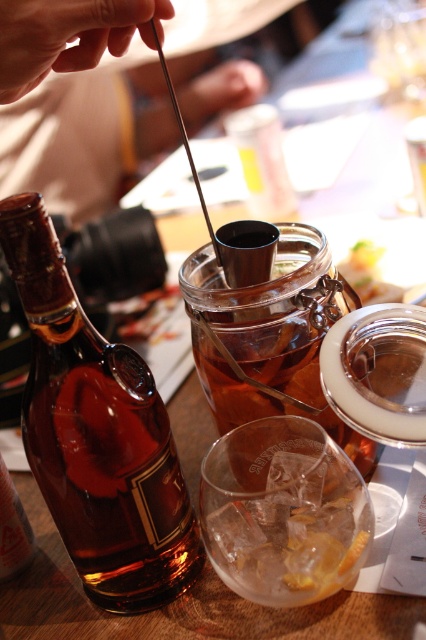
Which is below, metallic silver spoon at upper center or translucent glass jar at center?

translucent glass jar at center is below.

Between point (109, 33) and point (230, 390), which one is positioned behind?

The point (230, 390) is more distant.

Locate an element on the screen. This screenshot has height=640, width=426. metallic silver spoon at upper center is located at coordinates (66, 96).

Can you confirm if brown glass bottle at left is taller than translucent glass jar at center?

Correct, brown glass bottle at left is much taller as translucent glass jar at center.

I want to click on brown glass bottle at left, so click(x=97, y=433).

Identify the location of brown glass bottle at left. The image size is (426, 640). (97, 433).

Can you confirm if clear glass at center is bigger than translucent glass jar at center?

Actually, clear glass at center might be smaller than translucent glass jar at center.

Does clear glass at center appear on the right side of translucent glass jar at center?

Incorrect, clear glass at center is not on the right side of translucent glass jar at center.

Is point (307, 497) closer to viewer compared to point (247, 416)?

Yes, it is in front of point (247, 416).

Locate an element on the screen. Image resolution: width=426 pixels, height=640 pixels. clear glass at center is located at coordinates (282, 512).